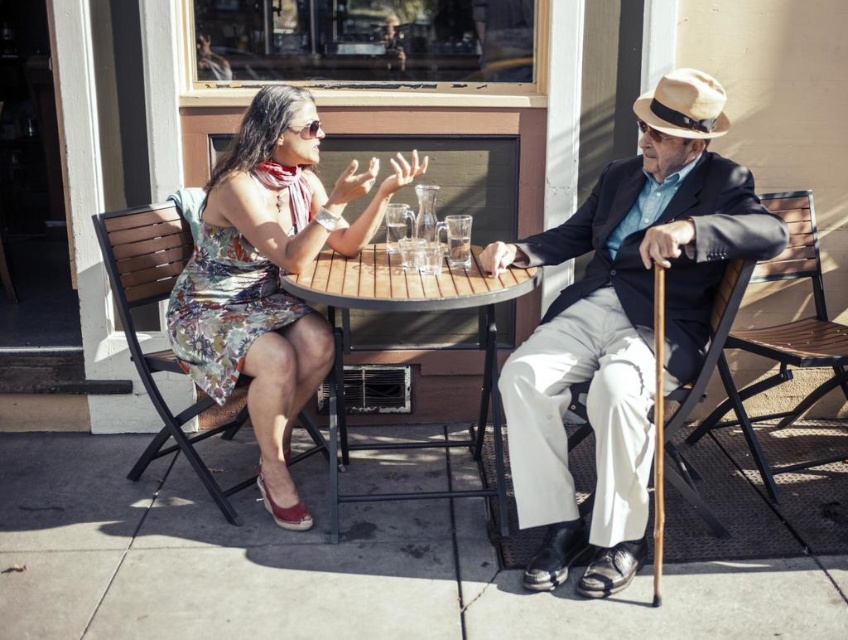
You are a waiter at a cafe and need to deliver a drink to the clear glass mug at center. The floral dress at left is occupied by a customer. Can you place the drink without moving the customer?

The distance between the floral dress at left and the clear glass mug at center is 22.46 inches. Since the customer is sitting and the mug is on the table, you can safely place the drink on the table near the clear glass mug at center without needing to move the customer.